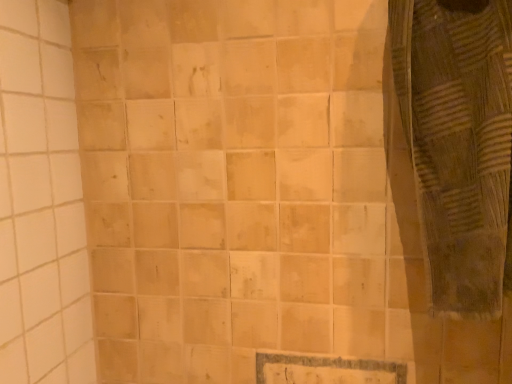
Question: Should I look upward or downward to see brown woven fabric at right?

Choices:
 (A) down
 (B) up

Answer: (B)